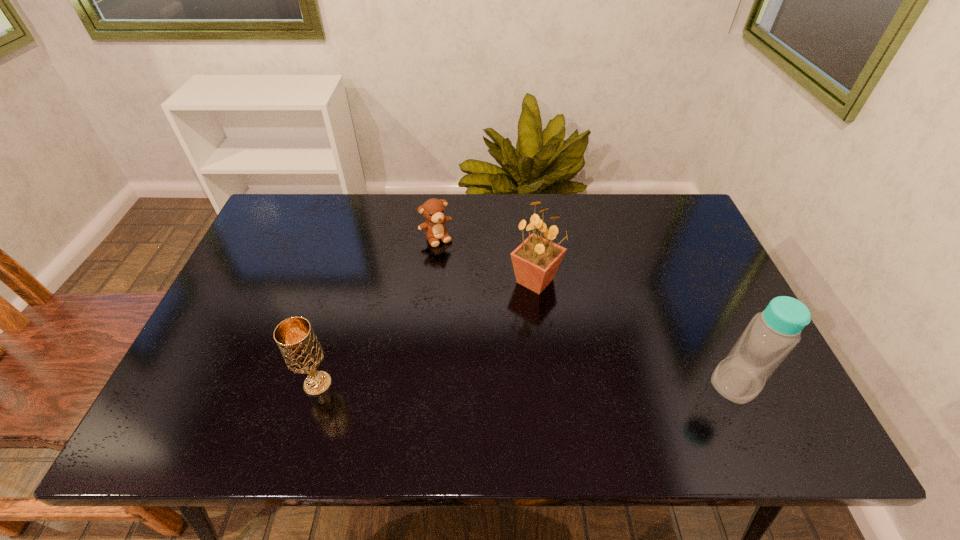
The height and width of the screenshot is (540, 960). I want to click on vacant space that satisfies the following two spatial constraints: 1. on the back side of the farthest object; 2. on the right side of the leftmost object, so click(360, 238).

You are a GUI agent. You are given a task and a screenshot of the screen. Output one action in this format:
    pyautogui.click(x=<x>, y=<y>)
    Task: Click on the vacant area that satisfies the following two spatial constraints: 1. on the back side of the chalice; 2. on the left side of the second object from right to left
    The width and height of the screenshot is (960, 540).
    Given the screenshot: What is the action you would take?
    pyautogui.click(x=348, y=281)

Find the location of `vacant space that satisfies the following two spatial constraints: 1. on the front side of the third nearest object; 2. on the left side of the rightmost object`. vacant space that satisfies the following two spatial constraints: 1. on the front side of the third nearest object; 2. on the left side of the rightmost object is located at coordinates (547, 383).